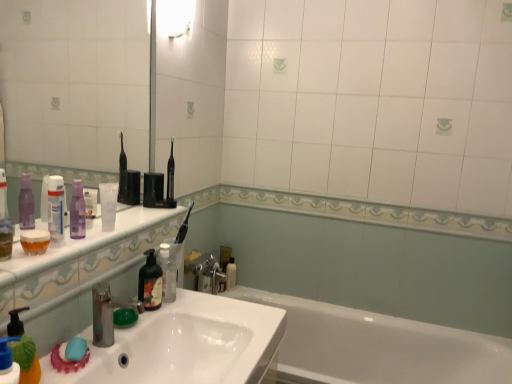
This screenshot has height=384, width=512. Identify the location of vacant area that is situated to the right of purple matte lotion at upper left, the second toiletry positioned from the bottom. (118, 231).